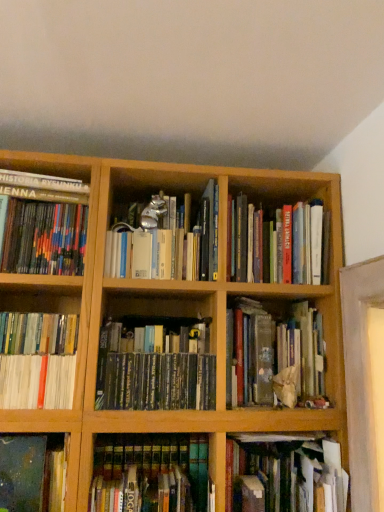
Question: Is white glossy book at lower left, the second book positioned from the left, completely or partially inside green matte book at center, the 1th book positioned from the right?

Choices:
 (A) no
 (B) yes

Answer: (A)

Question: From the image's perspective, is green matte book at center, the 1th book positioned from the right, on white glossy book at lower left, the second book positioned from the left?

Choices:
 (A) yes
 (B) no

Answer: (B)

Question: Is green matte book at center, the 1th book positioned from the right, positioned far away from white glossy book at lower left, the second book positioned from the left?

Choices:
 (A) no
 (B) yes

Answer: (A)

Question: Does green matte book at center, the 9th book in the left-to-right sequence, have a lesser width compared to white glossy book at lower left, the eighth book in the right-to-left sequence?

Choices:
 (A) yes
 (B) no

Answer: (A)

Question: Does green matte book at center, the 9th book in the left-to-right sequence, have a greater width compared to white glossy book at lower left, the second book positioned from the left?

Choices:
 (A) yes
 (B) no

Answer: (B)

Question: Is green matte book at center, the 9th book in the left-to-right sequence, positioned beyond the bounds of white glossy book at lower left, the second book positioned from the left?

Choices:
 (A) no
 (B) yes

Answer: (B)

Question: From a real-world perspective, is green matte book at center, acting as the fourth book starting from the left, on hardcover books at center, placed as the 8th book when sorted from left to right?

Choices:
 (A) no
 (B) yes

Answer: (A)

Question: Is green matte book at center, acting as the fourth book starting from the left, with hardcover books at center, placed as the 8th book when sorted from left to right?

Choices:
 (A) yes
 (B) no

Answer: (B)

Question: From the image's perspective, is green matte book at center, acting as the fourth book starting from the left, over hardcover books at center, placed as the 8th book when sorted from left to right?

Choices:
 (A) no
 (B) yes

Answer: (A)

Question: Is green matte book at center, which is counted as the 6th book, starting from the right, far away from hardcover books at center, placed as the 8th book when sorted from left to right?

Choices:
 (A) yes
 (B) no

Answer: (B)

Question: Considering the relative sizes of green matte book at center, which is counted as the 6th book, starting from the right, and hardcover books at center, the second book viewed from the right, in the image provided, is green matte book at center, which is counted as the 6th book, starting from the right, wider than hardcover books at center, the second book viewed from the right,?

Choices:
 (A) no
 (B) yes

Answer: (A)

Question: Is green matte book at center, acting as the fourth book starting from the left, shorter than hardcover books at center, placed as the 8th book when sorted from left to right?

Choices:
 (A) no
 (B) yes

Answer: (A)

Question: Is dark blue matte book at lower left, which is the 3th book from left to right, closer to the viewer compared to white glossy book at lower left, the second book positioned from the left?

Choices:
 (A) no
 (B) yes

Answer: (B)